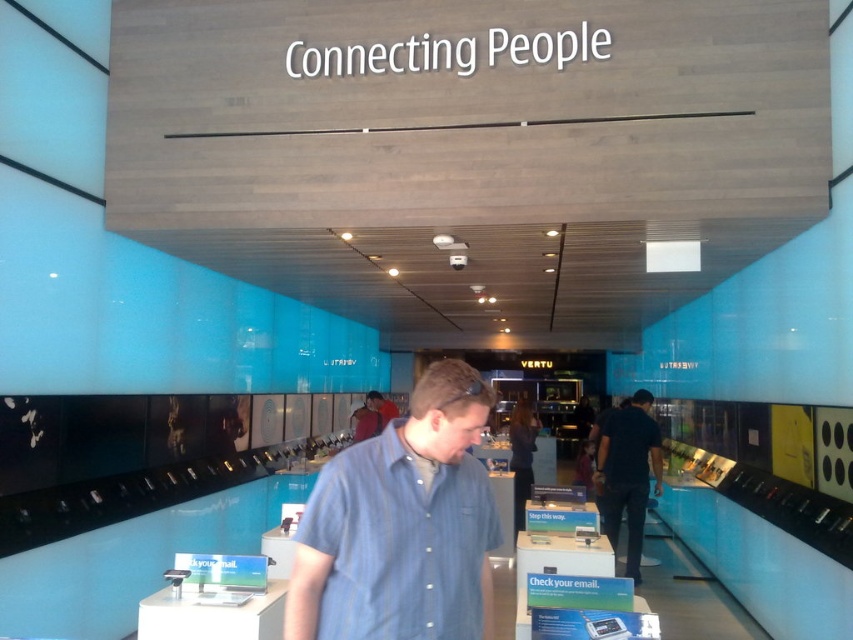
Between point (424, 538) and point (630, 509), which one is positioned in front?

Point (424, 538) is more forward.

Is point (450, 481) positioned before point (633, 486)?

Yes, point (450, 481) is in front of point (633, 486).

The image size is (853, 640). What are the coordinates of `blue striped shirt at center` in the screenshot? It's located at (402, 525).